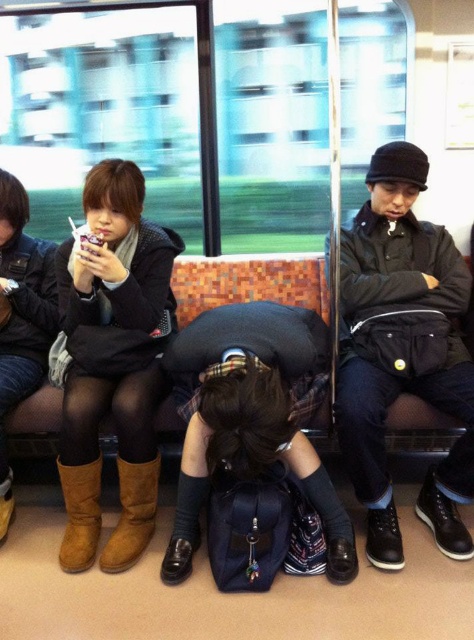
You are a photographer trying to capture a candid shot of the black leather jacket at upper right and the brown suede boot at lower center in the train scene. Since you want to ensure both subjects are in focus, which object should you prioritize focusing on first, considering their sizes?

The black leather jacket at upper right is larger than the brown suede boot at lower center, so you should focus on the black leather jacket at upper right first to ensure both are in focus.

You are a passenger on the train and you want to place your bag between the two brown suede boots at left and brown suede boot at lower center. Can you fit your bag there if your bag is 10 inches wide?

The distance between the brown suede boots at left and the brown suede boot at lower center is 9.23 inches. Since your bag is 10 inches wide, it will not fit in the space between them.

You are a passenger on the train and want to know which item is positioned to the right between the black leather jacket at upper right and the brown suede boot at lower center. Which one is it?

The black leather jacket at upper right is positioned to the right of the brown suede boot at lower center.